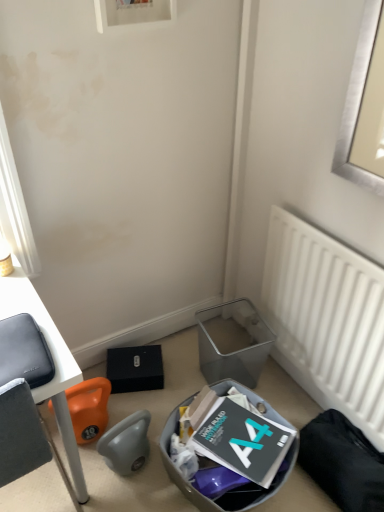
Question: Is matte black laptop at left taller or shorter than metallic gray trash bin/can at lower center, the 1th trash bin/can viewed from the back?

Choices:
 (A) short
 (B) tall

Answer: (B)

Question: Considering the positions of matte black laptop at left and metallic gray trash bin/can at lower center, the 1th trash bin/can viewed from the back, in the image, is matte black laptop at left wider or thinner than metallic gray trash bin/can at lower center, the 1th trash bin/can viewed from the back,?

Choices:
 (A) thin
 (B) wide

Answer: (B)

Question: Based on their relative distances, which object is farther from the metallic gray trash bin/can at lower center, the 1th trash bin/can viewed from the back?

Choices:
 (A) white matte radiator at right
 (B) matte black laptop at left
 (C) metallic gray trash bin at lower center, which is the 2th trash bin/can in back-to-front order

Answer: (B)

Question: Which of these objects is positioned closest to the white matte radiator at right?

Choices:
 (A) matte black laptop at left
 (B) metallic gray trash bin/can at lower center, the 1th trash bin/can viewed from the back
 (C) metallic gray trash bin at lower center, which is the 2th trash bin/can in back-to-front order

Answer: (B)